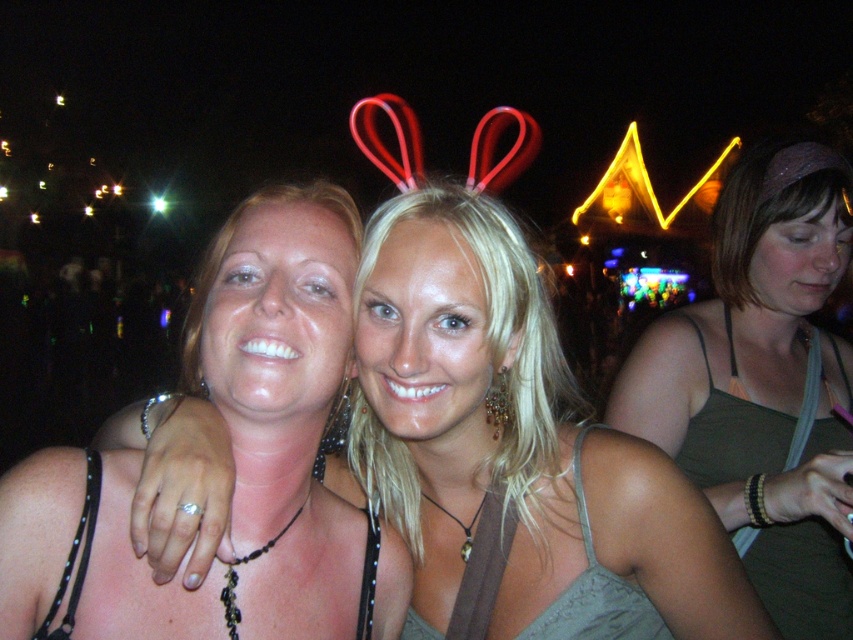
Does matte black tank top at center have a lesser height compared to matte green tank top at center?

Yes.

From the picture: Between matte black tank top at center and matte green tank top at center, which one has more height?

Standing taller between the two is matte green tank top at center.

Locate an element on the screen. The height and width of the screenshot is (640, 853). matte black tank top at center is located at coordinates (515, 445).